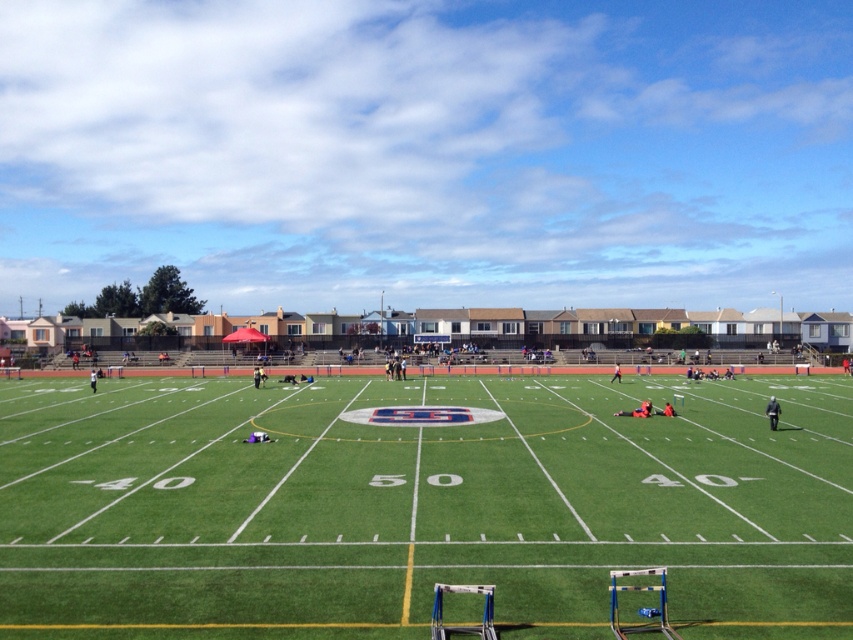
Question: Does red fabric person at center appear over black uniform at center?

Choices:
 (A) yes
 (B) no

Answer: (A)

Question: Can you confirm if red fabric person at center is wider than black uniform at center?

Choices:
 (A) yes
 (B) no

Answer: (B)

Question: Estimate the real-world distances between objects in this image. Which object is farther from the black fabric person at lower right?

Choices:
 (A) black uniform at center
 (B) orange fabric person at center

Answer: (A)

Question: Which object is closer to the camera taking this photo?

Choices:
 (A) metallic silver hurdle at lower center
 (B) black fabric person at lower right

Answer: (A)

Question: Which is farther from the black uniform at center?

Choices:
 (A) black uniformed person at left
 (B) light blue uniform at center

Answer: (B)

Question: Can you confirm if green artificial turf at center is positioned above metallic silver hurdle at lower center?

Choices:
 (A) no
 (B) yes

Answer: (A)